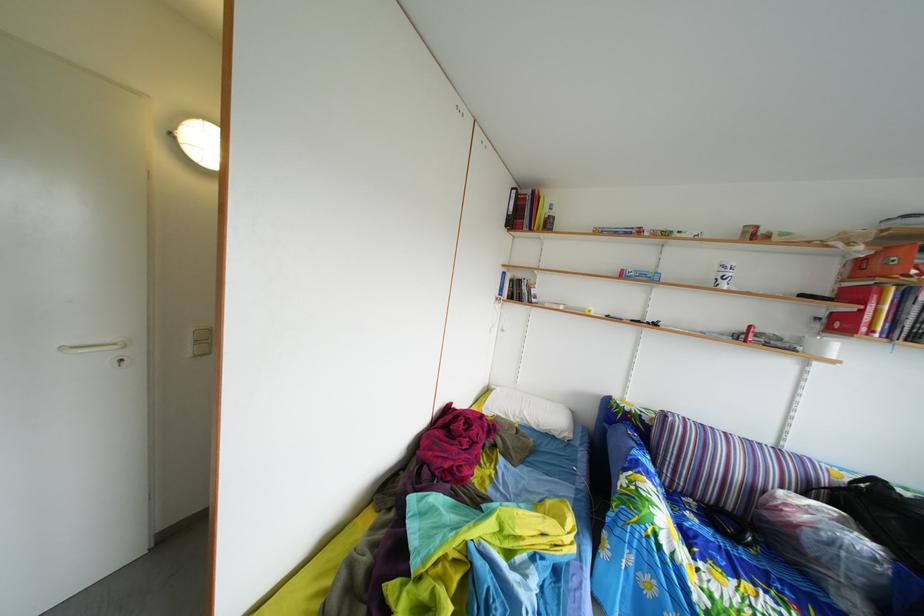
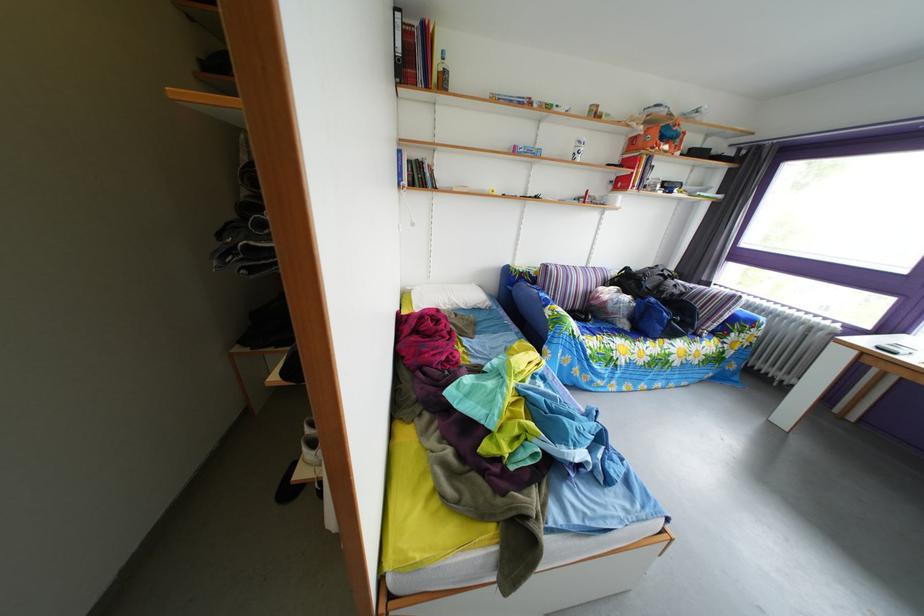
The point at (886, 515) is marked in the first image. Where is the corresponding point in the second image?

(638, 289)